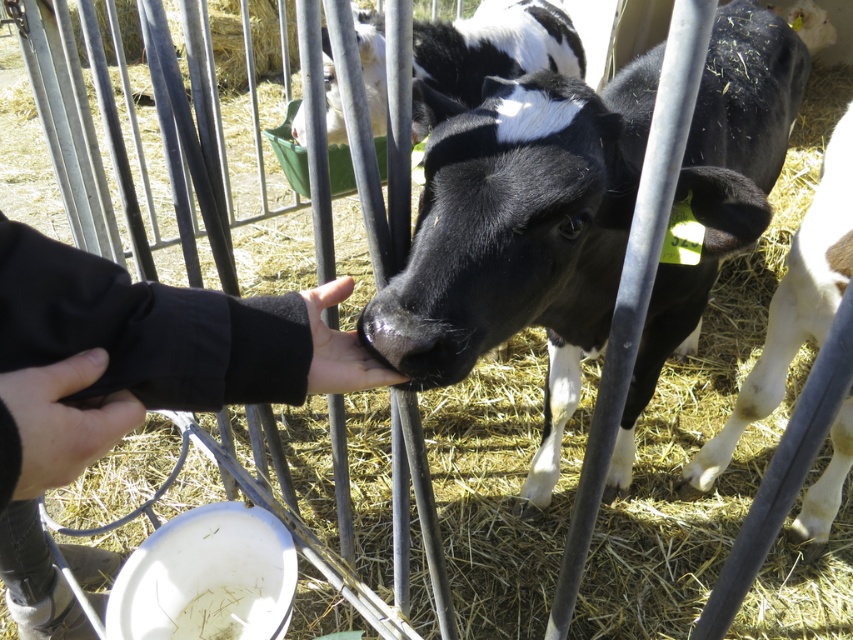
You are standing in a farm area and see the black smooth calf at center and the smooth skin hand at center. Which object is positioned more to the right side of the image?

The black smooth calf at center is positioned to the right of the smooth skin hand at center, so the black smooth calf at center is more to the right.

You are a farmer checking the calf enclosure. You notice the black soft hand at center and the smooth skin hand at center. Which hand can fit through the fence gaps more easily?

The black soft hand at center can fit through the fence gaps more easily because its width is less than the smooth skin hand at center.

You are standing at the origin point in the image. There are two points marked in the scene, point 1 at coordinates point (779, 280) and point 2 at coordinates point (310, 321). If you want to reach point 1 first before point 2, which direction should you move first?

Since point (779, 280) is behind point (310, 321), you should move backward to reach point 1 before point 2.